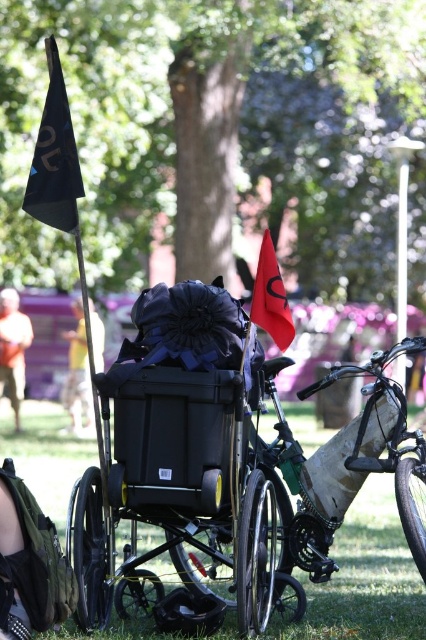
You are a photographer setting up equipment in the park. You have a metallic silver bicycle at center and a black fabric flag at upper left in your shot. Which object is closer to the camera?

The metallic silver bicycle at center is closer to the camera because the black fabric flag at upper left is behind it.

What is the position of the green grass at center in the image?

The green grass at center is located at point [365,577].